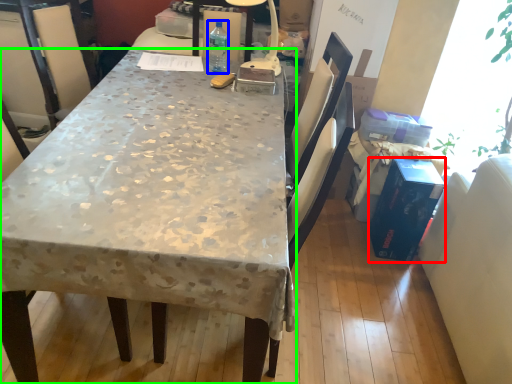
Question: Considering the real-world distances, which object is closest to box (highlighted by a red box)? bottle (highlighted by a blue box) or desk (highlighted by a green box).

Choices:
 (A) bottle
 (B) desk

Answer: (B)